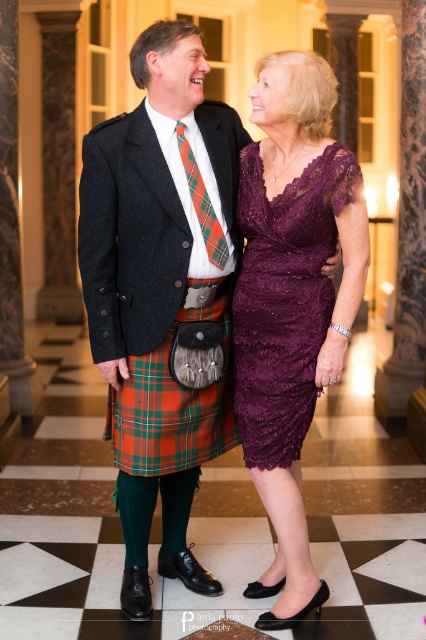
Question: Among these points, which one is farthest from the camera?

Choices:
 (A) (178, 513)
 (B) (325, 172)
 (C) (140, 390)

Answer: (A)

Question: Can you confirm if matte black suit at center is positioned above plaid fabric tie at center?

Choices:
 (A) no
 (B) yes

Answer: (A)

Question: Is orange plaid kilt at center to the right of plaid fabric tie at center from the viewer's perspective?

Choices:
 (A) no
 (B) yes

Answer: (A)

Question: Does matte black suit at center have a greater width compared to velvet purple dress at center?

Choices:
 (A) no
 (B) yes

Answer: (B)

Question: Among these points, which one is farthest from the camera?

Choices:
 (A) (324, 317)
 (B) (147, 182)

Answer: (A)

Question: Which point is closer to the camera taking this photo?

Choices:
 (A) (221, 250)
 (B) (259, 442)

Answer: (A)